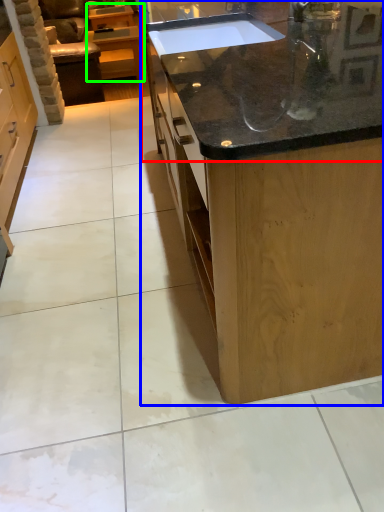
Question: Which object is positioned closest to countertop (highlighted by a red box)? Select from countertop (highlighted by a blue box) and cabinetry (highlighted by a green box).

Choices:
 (A) countertop
 (B) cabinetry

Answer: (A)